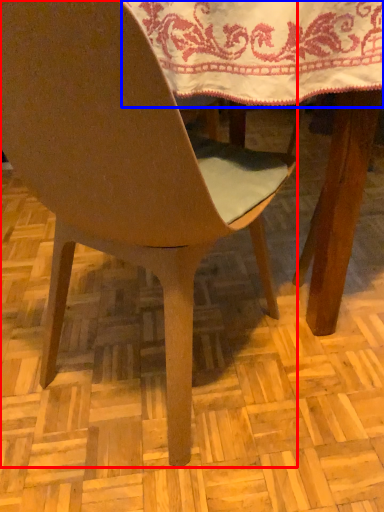
Question: Among these objects, which one is nearest to the camera, chair (highlighted by a red box) or tablecloth (highlighted by a blue box)?

Choices:
 (A) chair
 (B) tablecloth

Answer: (A)